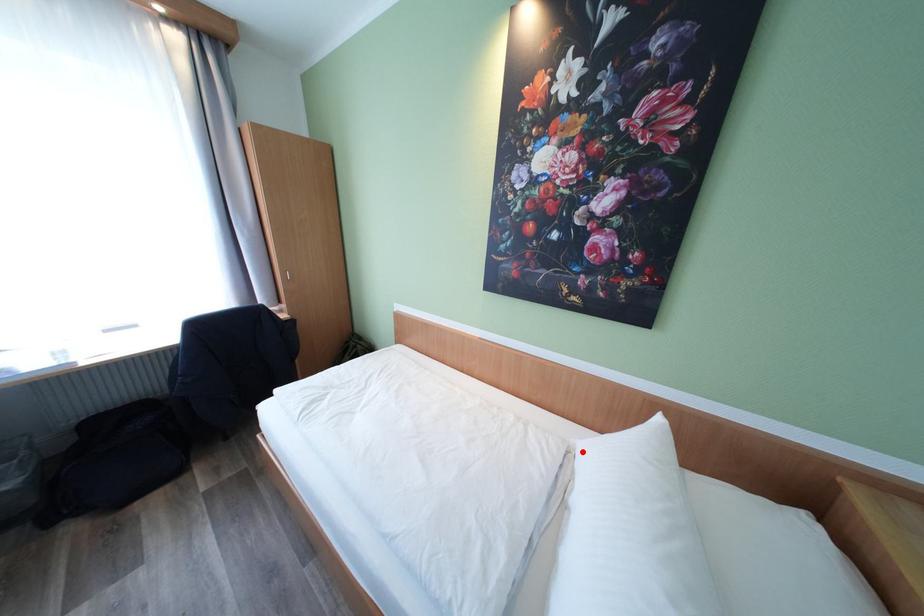
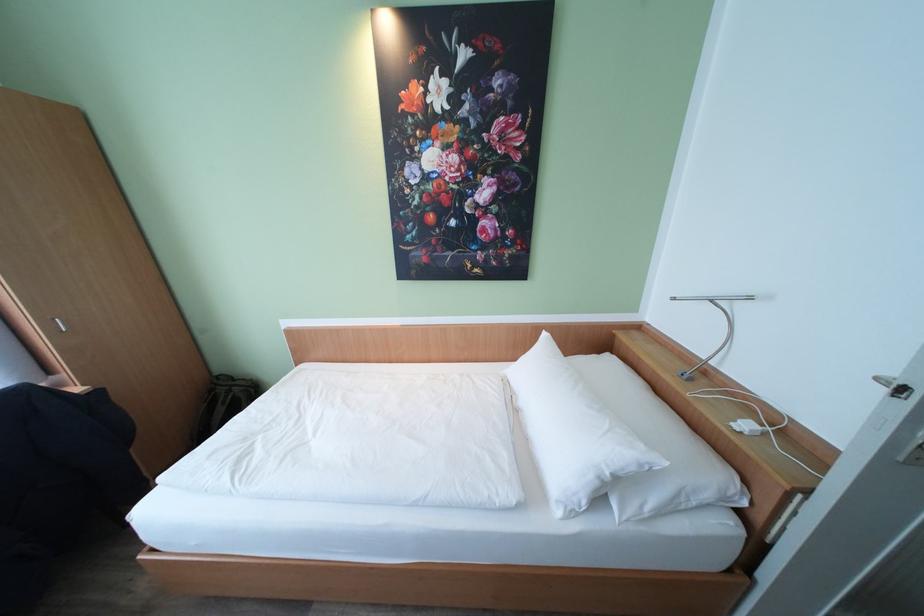
Question: A red point is marked in image1. In image2, is the corresponding 3D point closer to the camera or farther? Reply with the corresponding letter.

Choices:
 (A) The corresponding 3D point is closer.
 (B) The corresponding 3D point is farther.

Answer: (B)